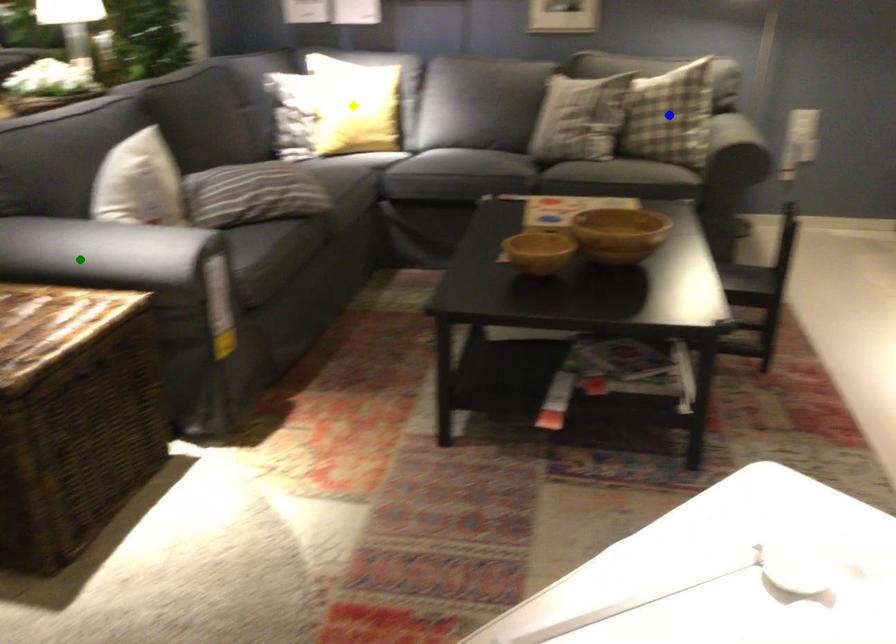
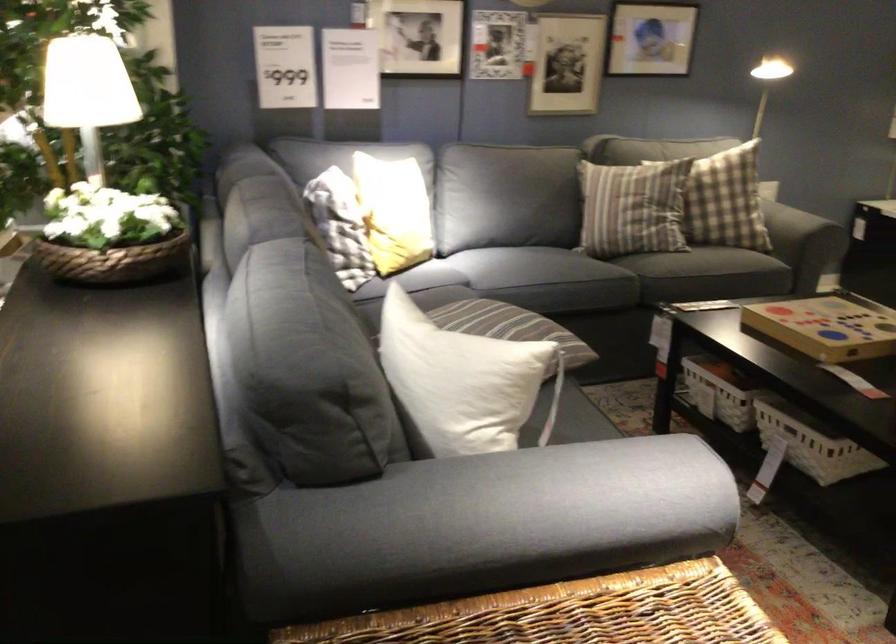
I am providing you with two images of the same scene from different viewpoints. Three points are marked in image1. Which point corresponds to a part or object that is occluded in image2?In image1, three points are marked. Which of them correspond to a part or object that is occluded in image2?Among the three points shown in image1, which one corresponds to a part or object that is no longer visible due to occlusion in image2?

yellow point, blue point